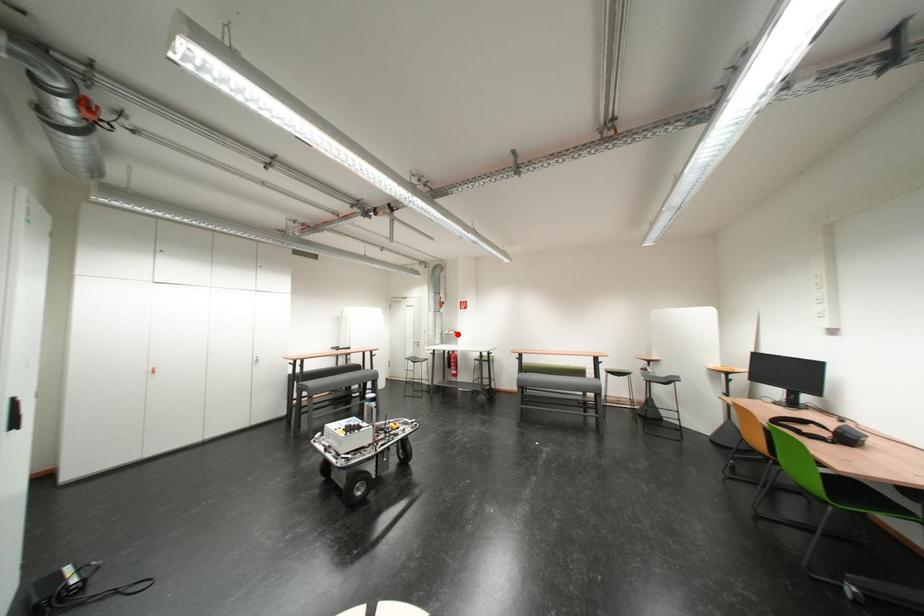
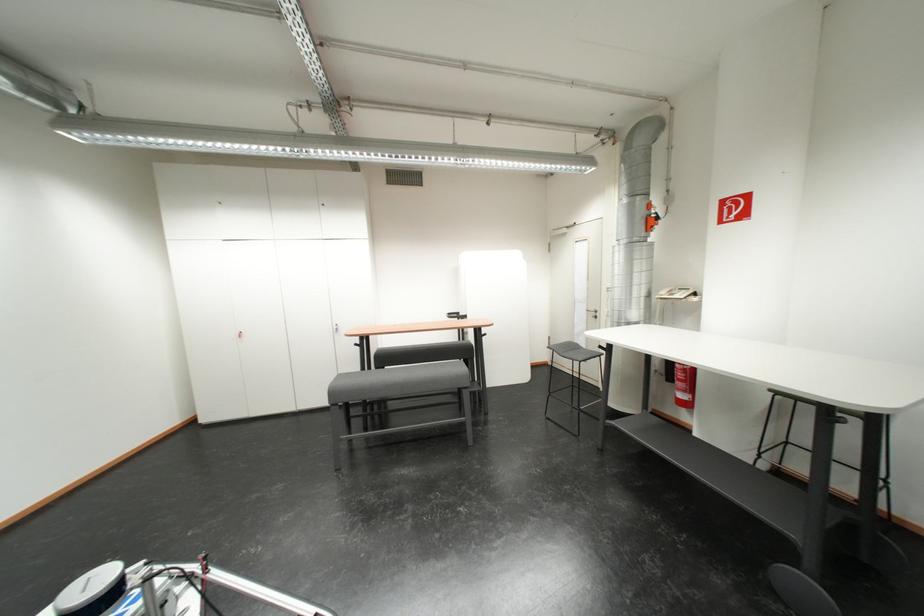
Locate, in the second image, the point that corresponds to the highlighted location in the first image.

(675, 296)